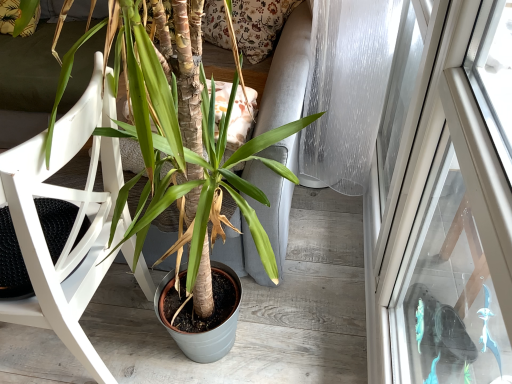
The height and width of the screenshot is (384, 512). Describe the element at coordinates (72, 226) in the screenshot. I see `white wood chair at left` at that location.

Identify the location of white wood chair at left. The width and height of the screenshot is (512, 384). [x=72, y=226].

The image size is (512, 384). What do you see at coordinates (74, 222) in the screenshot?
I see `matte brown pot at center` at bounding box center [74, 222].

In order to click on matte brown pot at center in this screenshot , I will do `click(74, 222)`.

Locate an element on the screen. The width and height of the screenshot is (512, 384). white wood chair at left is located at coordinates (72, 226).

Is white wood chair at left to the right of matte brown pot at center from the viewer's perspective?

Incorrect, white wood chair at left is not on the right side of matte brown pot at center.

Which object is more forward, white wood chair at left or matte brown pot at center?

matte brown pot at center is closer to the camera.

Does point (42, 291) come farther from viewer compared to point (73, 148)?

Yes, point (42, 291) is behind point (73, 148).

From the image's perspective, which is above, white wood chair at left or matte brown pot at center?

matte brown pot at center, from the image's perspective.

From a real-world perspective, who is located higher, white wood chair at left or matte brown pot at center?

In real-world perspective, matte brown pot at center is above.

Which of these two, white wood chair at left or matte brown pot at center, is wider?

With larger width is matte brown pot at center.

Which of these two, white wood chair at left or matte brown pot at center, stands shorter?

With less height is white wood chair at left.

Is white wood chair at left bigger than matte brown pot at center?

Incorrect, white wood chair at left is not larger than matte brown pot at center.

Is white wood chair at left spatially inside matte brown pot at center, or outside of it?

white wood chair at left can be found inside matte brown pot at center.

Is there a large distance between white wood chair at left and matte brown pot at center?

That's not correct — white wood chair at left is a little close to matte brown pot at center.

Does white wood chair at left turn towards matte brown pot at center?

No, white wood chair at left is not oriented towards matte brown pot at center.

At what (x,y) coordinates should I click in order to perform the action: click on chair directly beneath the matte brown pot at center (from a real-world perspective). Please return your answer as a coordinate pair (x, y). Looking at the image, I should click on (72, 226).

Would you say matte brown pot at center is to the left or to the right of white wood chair at left in the picture?

matte brown pot at center is positioned on white wood chair at left's right side.

Is matte brown pot at center positioned behind white wood chair at left?

No, it is in front of white wood chair at left.

Is point (36, 137) positioned in front of point (22, 245)?

Yes.

From the image's perspective, does matte brown pot at center appear higher than white wood chair at left?

Yes.

From a real-world perspective, is matte brown pot at center located beneath white wood chair at left?

Actually, matte brown pot at center is physically above white wood chair at left in the real world.

Does matte brown pot at center have a lesser width compared to white wood chair at left?

No, matte brown pot at center is not thinner than white wood chair at left.

Considering the sizes of matte brown pot at center and white wood chair at left in the image, is matte brown pot at center taller or shorter than white wood chair at left?

Considering their sizes, matte brown pot at center has more height than white wood chair at left.

Which of these two, matte brown pot at center or white wood chair at left, is smaller?

Smaller between the two is white wood chair at left.

Can white wood chair at left be found inside matte brown pot at center?

Yes, white wood chair at left is a part of matte brown pot at center.

Is matte brown pot at center touching white wood chair at left?

Indeed, matte brown pot at center and white wood chair at left are beside each other and touching.

Is matte brown pot at center turned away from white wood chair at left?

Yes, matte brown pot at center is facing away from white wood chair at left.

Can you tell me how much matte brown pot at center and white wood chair at left differ in facing direction?

The facing directions of matte brown pot at center and white wood chair at left are 3.54 degrees apart.

Locate an element on the screen. Image resolution: width=512 pixels, height=384 pixels. houseplant on the right of white wood chair at left is located at coordinates (74, 222).

The width and height of the screenshot is (512, 384). In the image, there is a matte brown pot at center. What are the coordinates of `chair below it (from a real-world perspective)` in the screenshot? It's located at (72, 226).

Where is `chair behind the matte brown pot at center`? chair behind the matte brown pot at center is located at coordinates (72, 226).